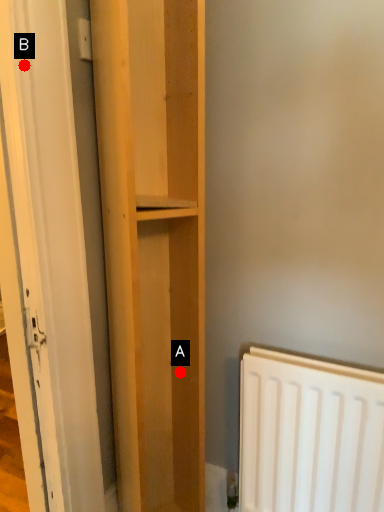
Question: Two points are circled on the image, labeled by A and B beside each circle. Among these points, which one is farthest from the camera?

Choices:
 (A) A is further
 (B) B is further

Answer: (A)